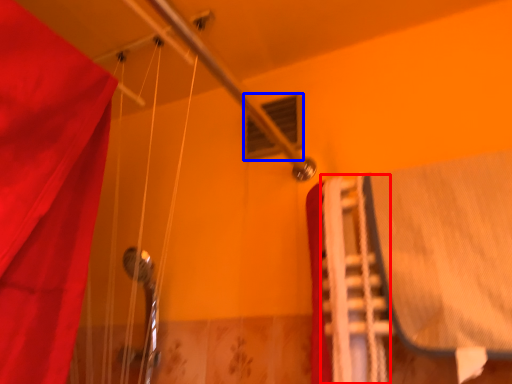
Question: Among these objects, which one is farthest to the camera, stair (highlighted by a red box) or window (highlighted by a blue box)?

Choices:
 (A) stair
 (B) window

Answer: (B)